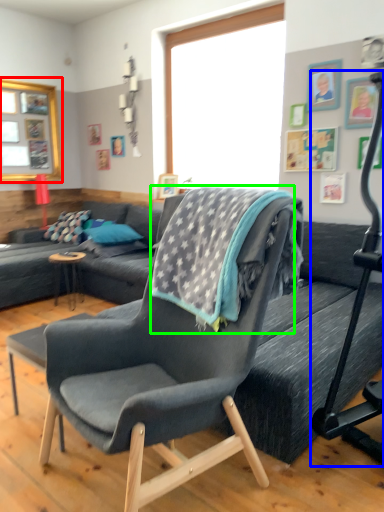
Question: Considering the real-world distances, which object is closest to window screen (highlighted by a red box)? baby carriage (highlighted by a blue box) or blanket (highlighted by a green box).

Choices:
 (A) baby carriage
 (B) blanket

Answer: (B)